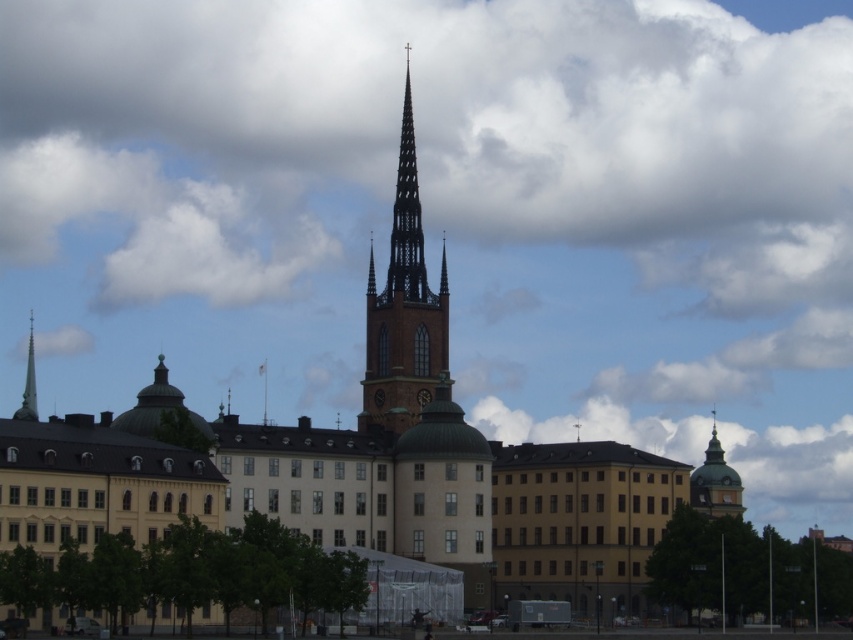
Question: Estimate the real-world distances between objects in this image. Which object is farther from the smooth silver spire at left?

Choices:
 (A) dark brown wooden clock at center
 (B) brown stone bell tower at center

Answer: (A)

Question: Among these points, which one is farthest from the camera?

Choices:
 (A) (407, 72)
 (B) (27, 392)
 (C) (711, 445)
 (D) (416, 401)

Answer: (B)

Question: Can you confirm if green domed tower at upper right is positioned to the left of smooth silver spire at left?

Choices:
 (A) no
 (B) yes

Answer: (A)

Question: Which of the following is the farthest from the observer?

Choices:
 (A) (427, 321)
 (B) (421, 388)
 (C) (16, 419)
 (D) (738, 480)

Answer: (D)

Question: Does green domed tower at upper right have a greater width compared to dark brown wooden clock at center?

Choices:
 (A) yes
 (B) no

Answer: (A)

Question: Does brown stone bell tower at center appear over smooth silver spire at left?

Choices:
 (A) no
 (B) yes

Answer: (B)